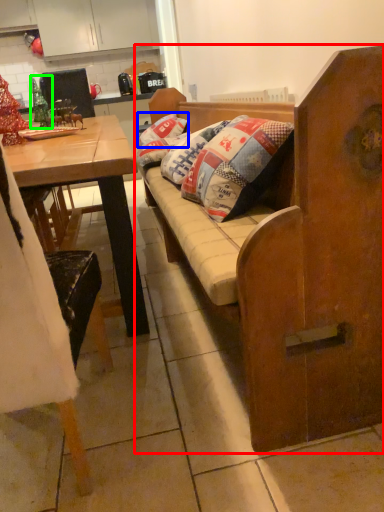
Question: Which is farther away from studio couch (highlighted by a red box)? pillow (highlighted by a blue box) or christmas decoration (highlighted by a green box)?

Choices:
 (A) pillow
 (B) christmas decoration

Answer: (A)